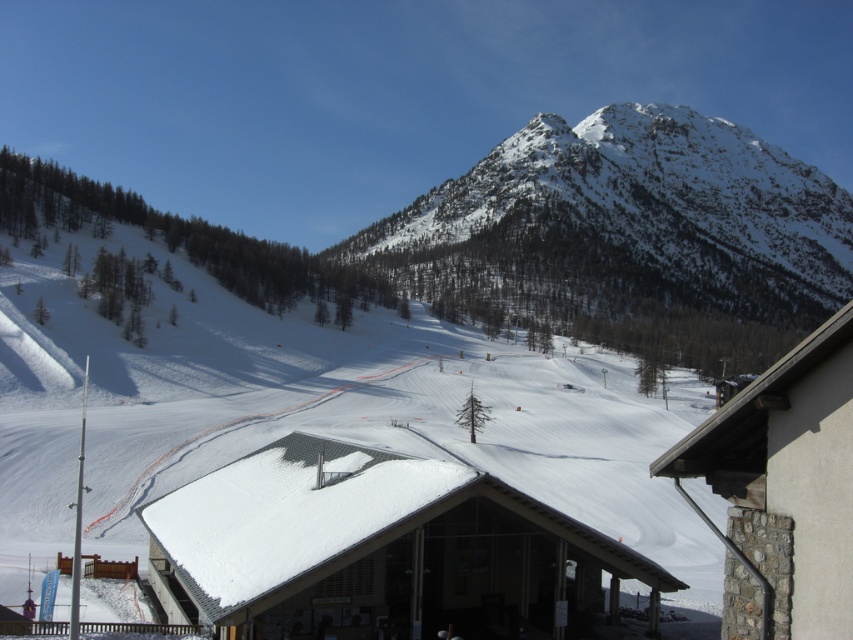
You are a skier planning to take a photo of the snowy rocky mountain at upper center and the white shingled roof at center from the ski slope. Which object will appear wider in your photo?

The snowy rocky mountain at upper center will appear wider in the photo because its width is larger than that of the white shingled roof at center.

You are a skier planning to take a photo of the white shingled roof at center and the snowy rocky mountain at upper center from the ski slope. Which object should you position yourself to the left of to have both in the frame?

You should position yourself to the left of the snowy rocky mountain at upper center because it is on the right side of the white shingled roof at center, so placing yourself left of the mountain will allow both objects to be in the frame.

You are a skier planning to take a photo of the white shingled roof at center from the snowy rocky mountain at upper center. Is the mountain positioned in a way that allows you to see the roof clearly without any obstructions?

The snowy rocky mountain at upper center is located above the white shingled roof at center, so yes, you can see the roof clearly from the mountain as it is positioned above it without any obstructions.